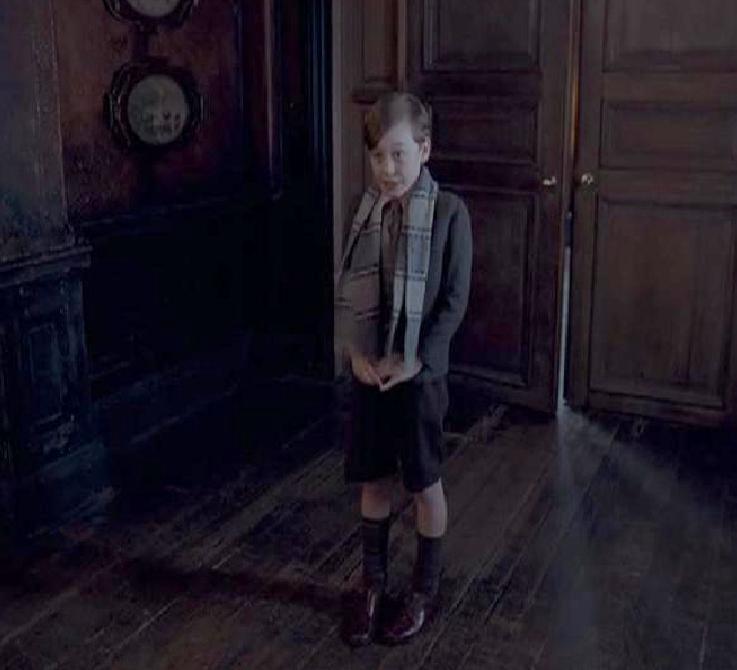
Locate an element on the screen. The width and height of the screenshot is (737, 670). hanging picture frames is located at coordinates (149, 68), (156, 17).